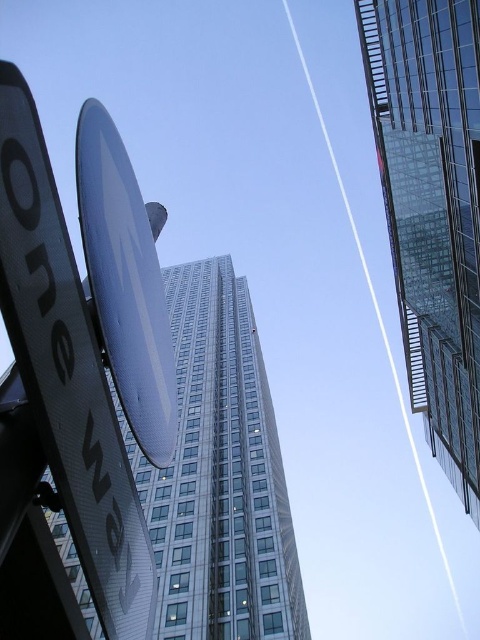
Who is shorter, glassy reflective skyscraper at center or transparent glass skyscraper at upper right?

With less height is transparent glass skyscraper at upper right.

Who is lower down, glassy reflective skyscraper at center or transparent glass skyscraper at upper right?

glassy reflective skyscraper at center

Does point (218, 531) lie in front of point (423, 189)?

No.

Identify the location of glassy reflective skyscraper at center. The width and height of the screenshot is (480, 640). (219, 474).

Is point (412, 284) positioned before point (86, 385)?

No, (412, 284) is further to viewer.

Measure the distance between point (423, 314) and camera.

Point (423, 314) and camera are 44.48 meters apart from each other.

Where is `transparent glass skyscraper at upper right`? transparent glass skyscraper at upper right is located at coordinates (432, 209).

Between transparent glass skyscraper at upper right and metallic silver satellite dish at upper center, which one is positioned lower?

metallic silver satellite dish at upper center is below.

Between point (475, 385) and point (120, 401), which one is positioned behind?

Point (475, 385)

You are a GUI agent. You are given a task and a screenshot of the screen. Output one action in this format:
    pyautogui.click(x=<x>, y=<y>)
    Task: Click on the transparent glass skyscraper at upper right
    
    Given the screenshot: What is the action you would take?
    pyautogui.click(x=432, y=209)